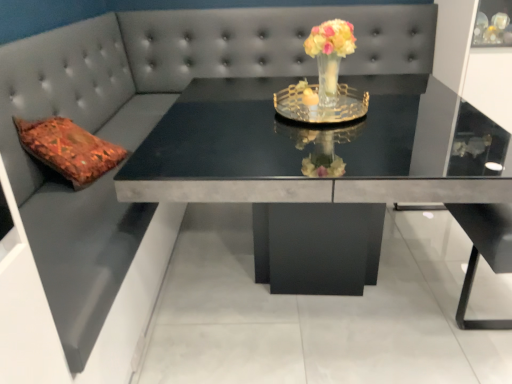
Question: Is matte gray table at center wider than translucent glass vase at center?

Choices:
 (A) yes
 (B) no

Answer: (A)

Question: Are matte gray table at center and translucent glass vase at center located far from each other?

Choices:
 (A) yes
 (B) no

Answer: (B)

Question: Considering the relative sizes of matte gray table at center and translucent glass vase at center in the image provided, is matte gray table at center thinner than translucent glass vase at center?

Choices:
 (A) no
 (B) yes

Answer: (A)

Question: From the image's perspective, is matte gray table at center located above translucent glass vase at center?

Choices:
 (A) yes
 (B) no

Answer: (B)

Question: Is matte gray table at center oriented towards translucent glass vase at center?

Choices:
 (A) yes
 (B) no

Answer: (B)

Question: Is matte gray table at center next to translucent glass vase at center and touching it?

Choices:
 (A) yes
 (B) no

Answer: (B)

Question: Considering the relative positions of translucent glass vase at center and matte gray table at center in the image provided, is translucent glass vase at center to the left of matte gray table at center from the viewer's perspective?

Choices:
 (A) no
 (B) yes

Answer: (A)

Question: Does translucent glass vase at center have a lesser width compared to matte gray table at center?

Choices:
 (A) no
 (B) yes

Answer: (B)

Question: Is translucent glass vase at center far from matte gray table at center?

Choices:
 (A) yes
 (B) no

Answer: (B)

Question: Is translucent glass vase at center positioned before matte gray table at center?

Choices:
 (A) yes
 (B) no

Answer: (B)

Question: Can you confirm if translucent glass vase at center is wider than matte gray table at center?

Choices:
 (A) no
 (B) yes

Answer: (A)

Question: From the image's perspective, is translucent glass vase at center beneath matte gray table at center?

Choices:
 (A) no
 (B) yes

Answer: (A)

Question: From a real-world perspective, relative to matte gray table at center, is translucent glass vase at center vertically above or below?

Choices:
 (A) below
 (B) above

Answer: (B)